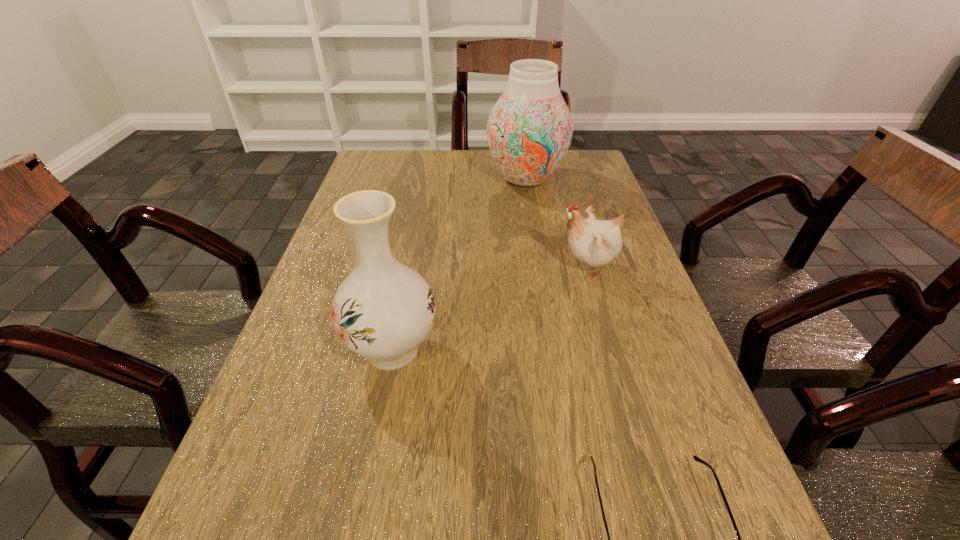
At what (x,y) coordinates should I click in order to perform the action: click on vacant area that lies between the bird and the nearer vase. Please return your answer as a coordinate pair (x, y). The width and height of the screenshot is (960, 540). Looking at the image, I should click on (490, 308).

I want to click on vacant point located between the leftmost object and the farther vase, so click(x=459, y=264).

Image resolution: width=960 pixels, height=540 pixels. I want to click on free area in between the right vase and the second farthest object, so click(x=557, y=223).

The width and height of the screenshot is (960, 540). In order to click on free spot between the leftmost object and the farthest object in this screenshot , I will do `click(459, 264)`.

The image size is (960, 540). Find the location of `object that is the second nearest to the right vase`. object that is the second nearest to the right vase is located at coordinates (383, 310).

Identify which object is the third closest to the second farthest object. Please provide its 2D coordinates. Your answer should be formatted as a tuple, i.e. [(x, y)], where the tuple contains the x and y coordinates of a point satisfying the conditions above.

[(696, 458)]